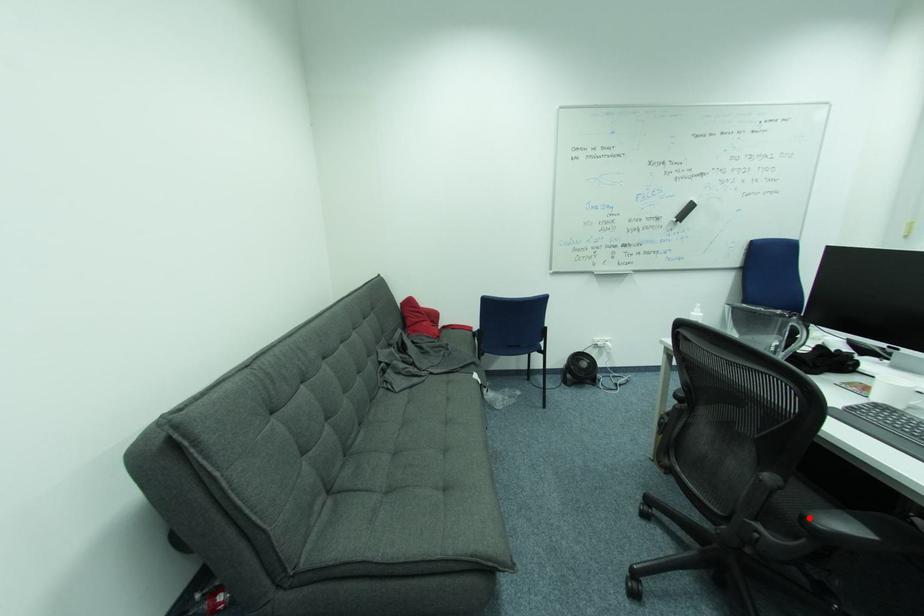
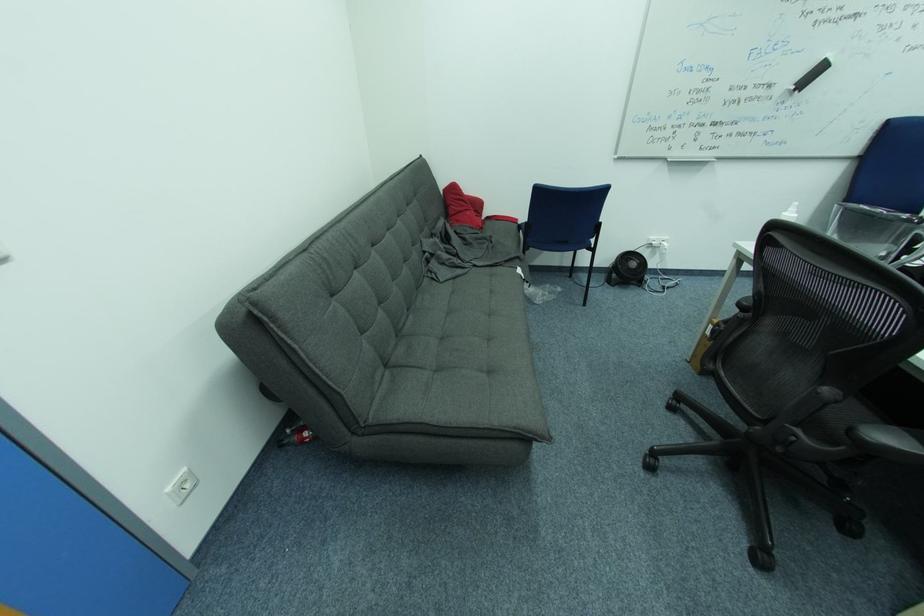
Find the pixel in the second image that matches the highlighted location in the first image.

(858, 430)